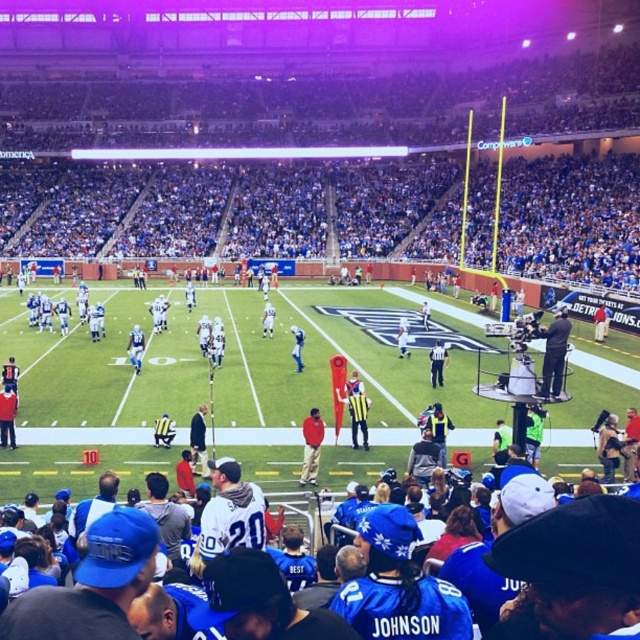
Who is lower down, white jersey at center or blue jersey at center?

Positioned lower is white jersey at center.

Is white jersey at center to the left of blue jersey at center from the viewer's perspective?

Correct, you'll find white jersey at center to the left of blue jersey at center.

The width and height of the screenshot is (640, 640). I want to click on white jersey at center, so click(134, 348).

Which is more to the left, red matte jacket at center or white uniformed official at center?

Positioned to the left is red matte jacket at center.

Is point (316, 420) positioned before point (440, 365)?

That is True.

Between point (314, 461) and point (442, 360), which one is positioned behind?

The point (442, 360) is behind.

I want to click on red matte jacket at center, so click(310, 445).

How far apart are blue jersey at center and white matte jersey at center?

The distance of blue jersey at center from white matte jersey at center is 5.25 meters.

Is blue jersey at center taller than white matte jersey at center?

Incorrect, blue jersey at center's height is not larger of white matte jersey at center's.

Find the location of `blue jersey at center`. blue jersey at center is located at coordinates (298, 346).

Identify the location of blue jersey at center. This screenshot has height=640, width=640. (298, 346).